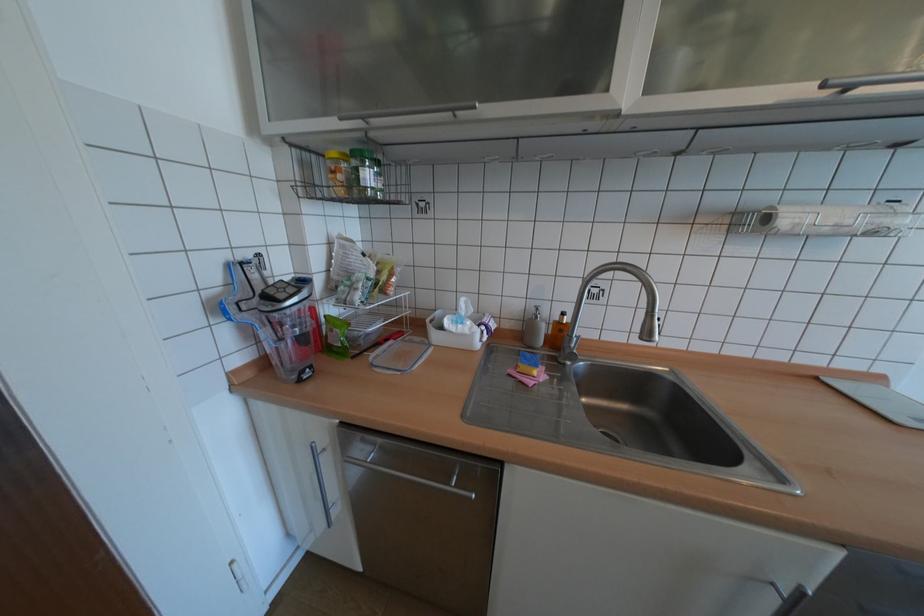
The image size is (924, 616). I want to click on the left cabinet handle, so click(x=321, y=483).